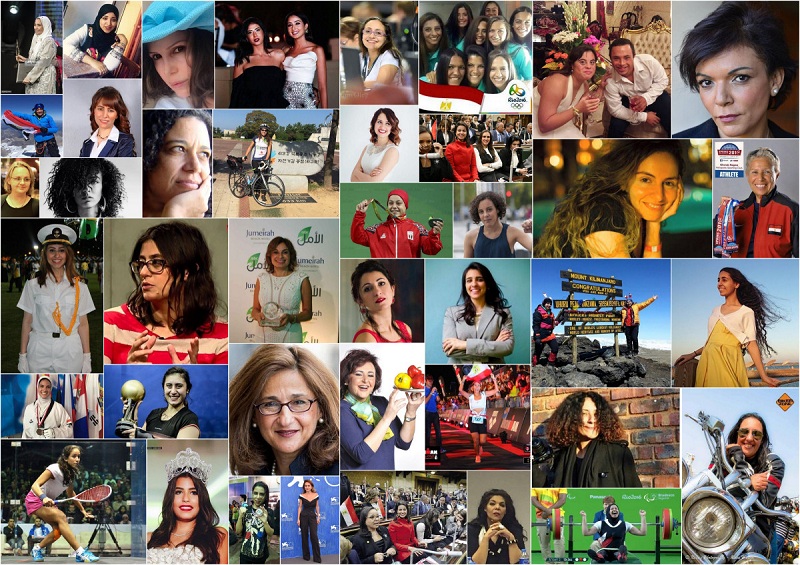
What are the coordinates of `solid backdrops` in the screenshot? It's located at (350, 124), (69, 93), (514, 284), (237, 346), (790, 180), (434, 197).